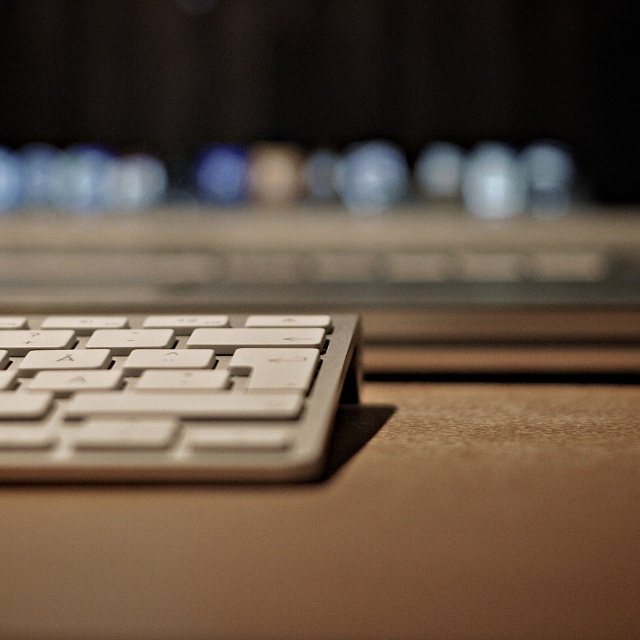
Question: From the image, what is the correct spatial relationship of white matte computer desk at lower center in relation to white plastic keyboard at lower left?

Choices:
 (A) left
 (B) right

Answer: (B)

Question: Is the position of white matte computer desk at lower center less distant than that of white plastic keyboard at lower left?

Choices:
 (A) no
 (B) yes

Answer: (B)

Question: Which of the following is the closest to the observer?

Choices:
 (A) white plastic keyboard at lower left
 (B) white matte computer desk at lower center

Answer: (B)

Question: In this image, where is white matte computer desk at lower center located relative to white plastic keyboard at lower left?

Choices:
 (A) right
 (B) left

Answer: (A)

Question: Which of the following is the farthest from the observer?

Choices:
 (A) white plastic keyboard at lower left
 (B) white matte computer desk at lower center

Answer: (A)

Question: Among these points, which one is farthest from the camera?

Choices:
 (A) (321, 483)
 (B) (19, 474)

Answer: (A)